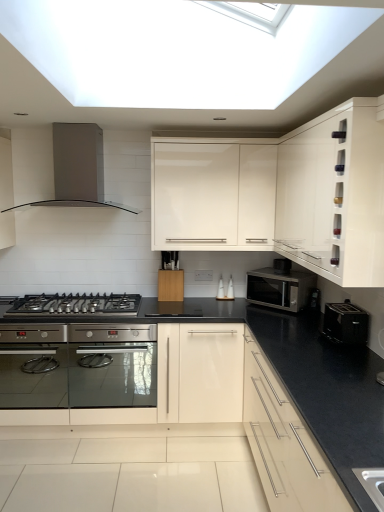
Question: Should I look upward or downward to see satin silver range hood at upper left?

Choices:
 (A) up
 (B) down

Answer: (A)

Question: Considering the relative sizes of white glossy cabinet at upper right, which is the 2th cabinetry from top to bottom, and matte white cabinet at lower right, placed as the first cabinetry when sorted from bottom to top, in the image provided, is white glossy cabinet at upper right, which is the 2th cabinetry from top to bottom, taller than matte white cabinet at lower right, placed as the first cabinetry when sorted from bottom to top,?

Choices:
 (A) no
 (B) yes

Answer: (A)

Question: Is white glossy cabinet at upper right, positioned as the 2th cabinetry in bottom-to-top order, thinner than matte white cabinet at lower right, the 3th cabinetry when ordered from top to bottom?

Choices:
 (A) yes
 (B) no

Answer: (A)

Question: Is matte white cabinet at lower right, placed as the first cabinetry when sorted from bottom to top, at the back of white glossy cabinet at upper right, positioned as the 2th cabinetry in bottom-to-top order?

Choices:
 (A) no
 (B) yes

Answer: (A)

Question: Is white glossy cabinet at upper right, positioned as the 2th cabinetry in bottom-to-top order, outside matte white cabinet at lower right, placed as the first cabinetry when sorted from bottom to top?

Choices:
 (A) yes
 (B) no

Answer: (A)

Question: Is white glossy cabinet at upper right, which is the 2th cabinetry from top to bottom, shorter than matte white cabinet at lower right, placed as the first cabinetry when sorted from bottom to top?

Choices:
 (A) no
 (B) yes

Answer: (B)

Question: From a real-world perspective, is white glossy cabinet at upper right, positioned as the 2th cabinetry in bottom-to-top order, over matte white cabinet at lower right, the 3th cabinetry when ordered from top to bottom?

Choices:
 (A) yes
 (B) no

Answer: (A)

Question: Considering the relative positions of black plastic toaster at right, the 2th appliance positioned from the right, and matte white cabinet at lower right, the 3th cabinetry when ordered from top to bottom, in the image provided, is black plastic toaster at right, the 2th appliance positioned from the right, to the left of matte white cabinet at lower right, the 3th cabinetry when ordered from top to bottom, from the viewer's perspective?

Choices:
 (A) no
 (B) yes

Answer: (A)

Question: Is black plastic toaster at right, the 1th appliance from the left, not inside matte white cabinet at lower right, the 3th cabinetry when ordered from top to bottom?

Choices:
 (A) yes
 (B) no

Answer: (A)

Question: Is black plastic toaster at right, the second appliance ordered from the bottom, positioned behind matte white cabinet at lower right, the 3th cabinetry when ordered from top to bottom?

Choices:
 (A) yes
 (B) no

Answer: (A)

Question: From the image's perspective, would you say black plastic toaster at right, the 1th appliance from the top, is positioned over matte white cabinet at lower right, the 3th cabinetry when ordered from top to bottom?

Choices:
 (A) yes
 (B) no

Answer: (A)

Question: Does black plastic toaster at right, the 2th appliance positioned from the right, have a lesser width compared to matte white cabinet at lower right, the 3th cabinetry when ordered from top to bottom?

Choices:
 (A) no
 (B) yes

Answer: (B)

Question: Can matte white cabinet at lower right, the 3th cabinetry when ordered from top to bottom, be found inside black plastic toaster at right, marked as the second appliance in a front-to-back arrangement?

Choices:
 (A) yes
 (B) no

Answer: (B)

Question: Does satin silver microwave at center-right have a greater width compared to matte white cabinet at lower right, the 3th cabinetry when ordered from top to bottom?

Choices:
 (A) no
 (B) yes

Answer: (A)